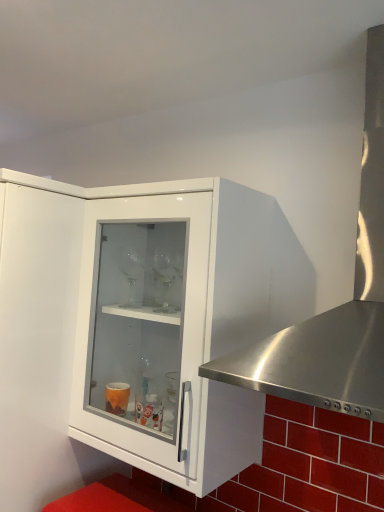
This screenshot has width=384, height=512. What do you see at coordinates (136, 316) in the screenshot? I see `white glossy cabinet at center` at bounding box center [136, 316].

What is the approximate width of white glossy cabinet at center?

It is 13.02 inches.

Where is `white glossy cabinet at center`? white glossy cabinet at center is located at coordinates (136, 316).

Describe the element at coordinates (336, 307) in the screenshot. I see `stainless steel range hood at right` at that location.

Where is `stainless steel range hood at right`? stainless steel range hood at right is located at coordinates (336, 307).

Where is `white glossy cabinet at center`? Image resolution: width=384 pixels, height=512 pixels. white glossy cabinet at center is located at coordinates (136, 316).

Is white glossy cabinet at center to the right of stainless steel range hood at right from the viewer's perspective?

Incorrect, white glossy cabinet at center is not on the right side of stainless steel range hood at right.

Who is more distant, white glossy cabinet at center or stainless steel range hood at right?

white glossy cabinet at center is more distant.

Does point (73, 396) lie behind point (379, 274)?

Yes, point (73, 396) is farther from viewer.

From the image's perspective, which is below, white glossy cabinet at center or stainless steel range hood at right?

From the image's view, white glossy cabinet at center is below.

From a real-world perspective, does white glossy cabinet at center sit lower than stainless steel range hood at right?

Indeed, from a real-world perspective, white glossy cabinet at center is positioned beneath stainless steel range hood at right.

Which of these two, white glossy cabinet at center or stainless steel range hood at right, is wider?

With larger width is stainless steel range hood at right.

Does white glossy cabinet at center have a greater height compared to stainless steel range hood at right?

Correct, white glossy cabinet at center is much taller as stainless steel range hood at right.

Can you confirm if white glossy cabinet at center is bigger than stainless steel range hood at right?

Actually, white glossy cabinet at center might be smaller than stainless steel range hood at right.

Choose the correct answer: Is white glossy cabinet at center inside stainless steel range hood at right or outside it?

white glossy cabinet at center is outside stainless steel range hood at right.

Is white glossy cabinet at center with stainless steel range hood at right?

white glossy cabinet at center is not next to stainless steel range hood at right, and they're not touching.

Is white glossy cabinet at center positioned with its back to stainless steel range hood at right?

No, white glossy cabinet at center is not facing away from stainless steel range hood at right.

How different are the orientations of white glossy cabinet at center and stainless steel range hood at right in degrees?

The facing directions of white glossy cabinet at center and stainless steel range hood at right are 0.706 degrees apart.

Where is `kitchen appliance that appears in front of the white glossy cabinet at center`? Image resolution: width=384 pixels, height=512 pixels. kitchen appliance that appears in front of the white glossy cabinet at center is located at coordinates (336, 307).

Which is more to the right, stainless steel range hood at right or white glossy cabinet at center?

stainless steel range hood at right.

Consider the image. Which object is further away from the camera, stainless steel range hood at right or white glossy cabinet at center?

white glossy cabinet at center is further away from the camera.

Considering the points (380, 168) and (22, 307), which point is behind, point (380, 168) or point (22, 307)?

Positioned behind is point (22, 307).

From the image's perspective, would you say stainless steel range hood at right is shown under white glossy cabinet at center?

Incorrect, from the image's perspective, stainless steel range hood at right is higher than white glossy cabinet at center.

From a real-world perspective, who is located lower, stainless steel range hood at right or white glossy cabinet at center?

white glossy cabinet at center, from a real-world perspective.

Can you confirm if stainless steel range hood at right is thinner than white glossy cabinet at center?

In fact, stainless steel range hood at right might be wider than white glossy cabinet at center.

Which of these two, stainless steel range hood at right or white glossy cabinet at center, stands shorter?

With less height is stainless steel range hood at right.

In terms of size, does stainless steel range hood at right appear bigger or smaller than white glossy cabinet at center?

Clearly, stainless steel range hood at right is larger in size than white glossy cabinet at center.

Can we say stainless steel range hood at right lies outside white glossy cabinet at center?

Yes.

Is stainless steel range hood at right touching white glossy cabinet at center?

They are not placed beside each other.

Looking at this image, is white glossy cabinet at center at the back of stainless steel range hood at right?

stainless steel range hood at right does not have its back to white glossy cabinet at center.

How many degrees apart are the facing directions of stainless steel range hood at right and white glossy cabinet at center?

The facing directions of stainless steel range hood at right and white glossy cabinet at center are 0.706 degrees apart.

Locate an element on the screen. kitchen appliance that appears in front of the white glossy cabinet at center is located at coordinates (336, 307).

Find the location of a particular element. The width and height of the screenshot is (384, 512). cabinetry that appears below the stainless steel range hood at right (from the image's perspective) is located at coordinates (136, 316).

You are a GUI agent. You are given a task and a screenshot of the screen. Output one action in this format:
    pyautogui.click(x=<x>, y=<y>)
    Task: Click on the cabinetry below the stainless steel range hood at right (from a real-world perspective)
    This screenshot has height=512, width=384.
    Given the screenshot: What is the action you would take?
    pyautogui.click(x=136, y=316)